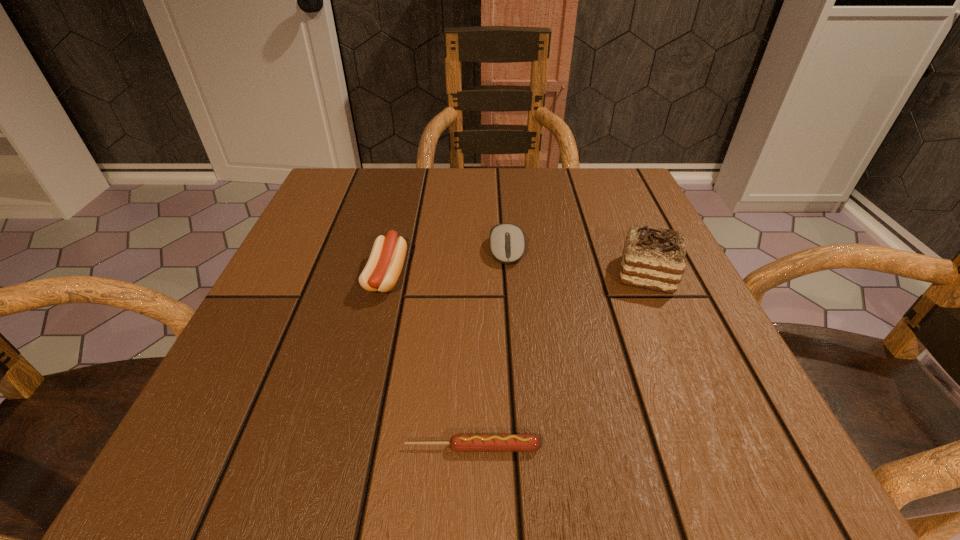
Image resolution: width=960 pixels, height=540 pixels. Find the location of `free location located 0.180m on the left of the shortest object`. free location located 0.180m on the left of the shortest object is located at coordinates (260, 447).

This screenshot has width=960, height=540. What are the coordinates of `object present at the near edge` in the screenshot? It's located at (459, 442).

Locate an element on the screen. This screenshot has height=540, width=960. object that is positioned at the right edge is located at coordinates (653, 258).

This screenshot has height=540, width=960. Identify the location of vacant space at the far edge of the desktop. (463, 211).

The width and height of the screenshot is (960, 540). I want to click on vacant space at the near edge of the desktop, so click(329, 434).

The height and width of the screenshot is (540, 960). I want to click on free location at the left edge of the desktop, so click(299, 264).

You are a GUI agent. You are given a task and a screenshot of the screen. Output one action in this format:
    pyautogui.click(x=<x>, y=<y>)
    Task: Click on the blank area at the right edge
    This screenshot has width=960, height=540.
    Given the screenshot: What is the action you would take?
    pyautogui.click(x=685, y=273)

Where is `vacant space at the far left corner`? The image size is (960, 540). vacant space at the far left corner is located at coordinates (361, 211).

I want to click on vacant space at the near left corner of the desktop, so click(x=190, y=461).

This screenshot has height=540, width=960. What are the coordinates of `free space between the third tallest object and the rightmost object` in the screenshot? It's located at (577, 262).